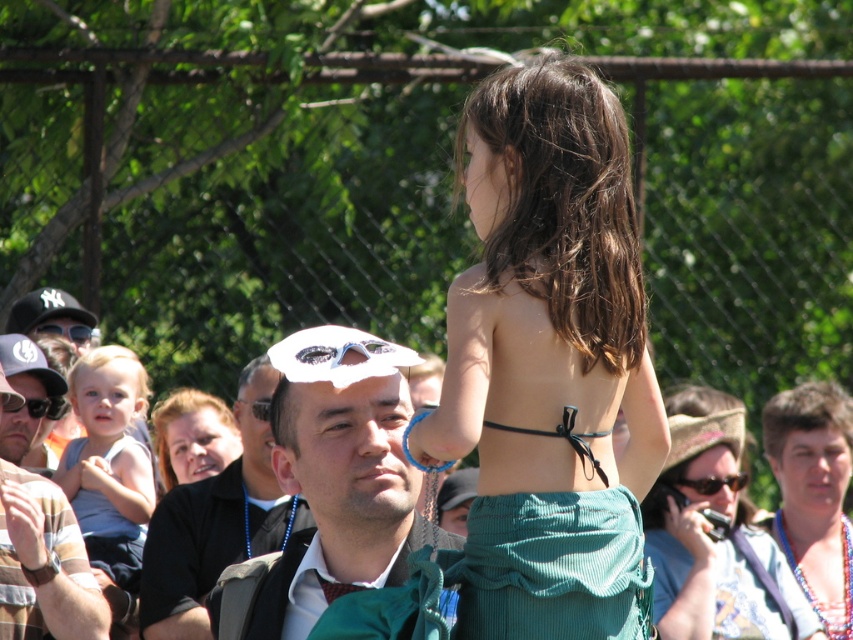
In the scene shown: Which is more to the right, black satin bikini top at upper center or blonde hair at center?

black satin bikini top at upper center is more to the right.

Is point (782, 433) positioned in front of point (227, 412)?

Yes, point (782, 433) is closer to viewer.

Who is more distant from viewer, (x=842, y=604) or (x=213, y=424)?

The point (x=213, y=424) is behind.

At what (x,y) coordinates should I click in order to perform the action: click on black satin bikini top at upper center. Please return your answer as a coordinate pair (x, y). Looking at the image, I should click on (814, 493).

Can you confirm if matte green skirt at center is bigger than matte black sunglasses at upper left?

Yes.

Measure the distance from matte green skirt at center to matte black sunglasses at upper left.

A distance of 3.22 meters exists between matte green skirt at center and matte black sunglasses at upper left.

Is point (695, 387) positioned after point (45, 330)?

That is True.

This screenshot has height=640, width=853. Find the location of `matte green skirt at center`. matte green skirt at center is located at coordinates (714, 536).

Is point (222, 436) behind point (741, 480)?

Yes, point (222, 436) is behind point (741, 480).

Can you confirm if blonde hair at center is thinner than white matte goggles at center?

No, blonde hair at center is not thinner than white matte goggles at center.

The image size is (853, 640). I want to click on blonde hair at center, so click(x=193, y=436).